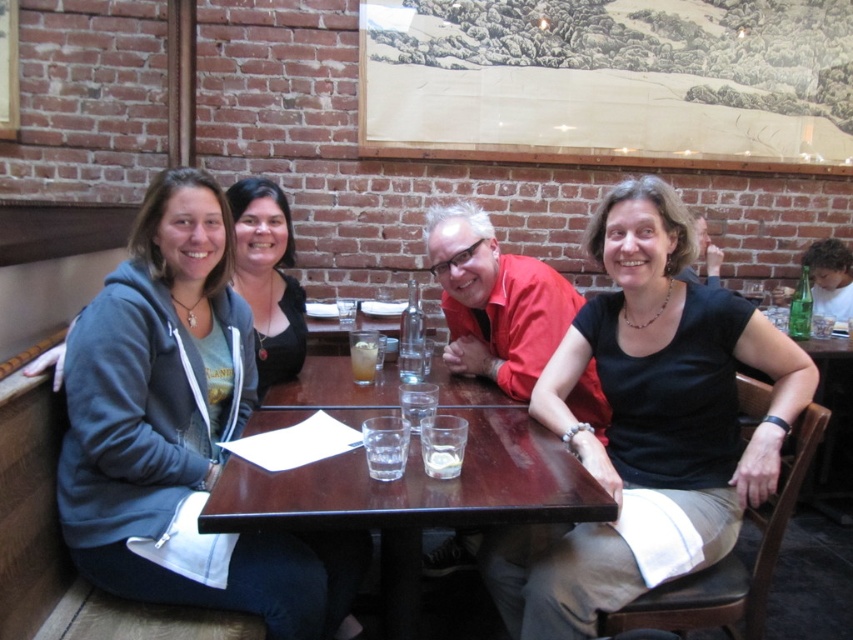
You are a waiter at the restaurant and need to place a new drink order on the table. The table has a matte gray hoodie at left and a translucent glass drink at table center. Which object should you avoid placing the new drink near to prevent it from being knocked over?

You should avoid placing the new drink near the translucent glass drink at table center because the matte gray hoodie at left is much taller and could potentially block access or cause instability if the drink is placed too close.